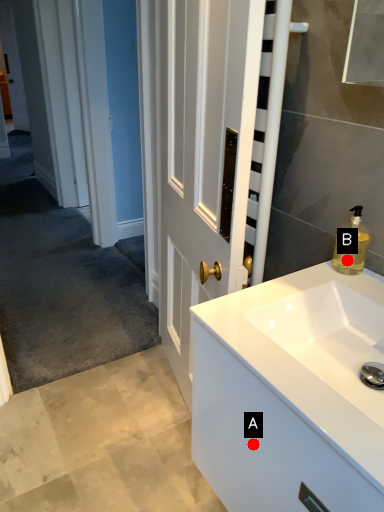
Question: Two points are circled on the image, labeled by A and B beside each circle. Among these points, which one is nearest to the camera?

Choices:
 (A) A is closer
 (B) B is closer

Answer: (A)